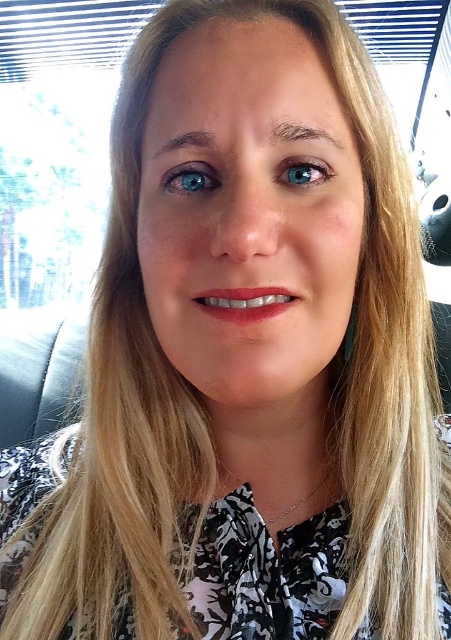
You are a photographer adjusting the focus on a camera. You want to ensure both the blue glossy eye at upper left and the blue glossy eye at center are in focus. Given that the camera can only focus on objects within a 1.5 inch range, will both eyes be in focus?

The distance between the blue glossy eye at upper left and blue glossy eye at center is 1.73 inches. Since the camera can only focus on objects within a .5 inch range, the two eyes are slightly out of the focus range, so they cannot both be in focus simultaneously.

What are the coordinates of the blue glossy eye at upper left?

The blue glossy eye at upper left is located at point [191,177].

You are a photographer adjusting the lighting in a car. You notice a blue glossy eye at upper left marked by point (x=191, y=177). To ensure proper lighting on this point, where should you position the light source relative to the subject?

The blue glossy eye at upper left is represented by point (x=191, y=177). To ensure proper lighting, the light source should be positioned above and to the left of the subject, as this placement will illuminate the eye effectively without causing harsh shadows.